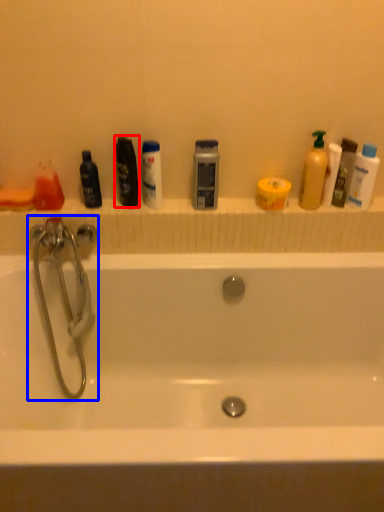
Question: Which of the following is the closest to the observer, mouthwash (highlighted by a red box) or tap (highlighted by a blue box)?

Choices:
 (A) mouthwash
 (B) tap

Answer: (B)